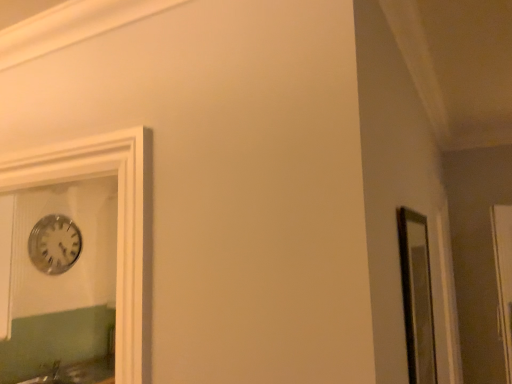
Question: Is transparent glass door at right at the right side of matte glass mirror at right?

Choices:
 (A) no
 (B) yes

Answer: (B)

Question: Is transparent glass door at right surrounding matte glass mirror at right?

Choices:
 (A) yes
 (B) no

Answer: (B)

Question: From a real-world perspective, is transparent glass door at right physically above matte glass mirror at right?

Choices:
 (A) no
 (B) yes

Answer: (A)

Question: Is transparent glass door at right facing towards matte glass mirror at right?

Choices:
 (A) yes
 (B) no

Answer: (B)

Question: Can you confirm if transparent glass door at right is positioned to the left of matte glass mirror at right?

Choices:
 (A) yes
 (B) no

Answer: (B)

Question: From a real-world perspective, is transparent glass door at right physically below matte glass mirror at right?

Choices:
 (A) no
 (B) yes

Answer: (B)

Question: Are transparent glass door at right and silver metallic clock at upper left making contact?

Choices:
 (A) yes
 (B) no

Answer: (B)

Question: Considering the relative sizes of transparent glass door at right and silver metallic clock at upper left in the image provided, is transparent glass door at right thinner than silver metallic clock at upper left?

Choices:
 (A) no
 (B) yes

Answer: (A)

Question: Is transparent glass door at right surrounding silver metallic clock at upper left?

Choices:
 (A) yes
 (B) no

Answer: (B)

Question: Can you confirm if transparent glass door at right is smaller than silver metallic clock at upper left?

Choices:
 (A) yes
 (B) no

Answer: (B)

Question: Considering the relative sizes of transparent glass door at right and silver metallic clock at upper left in the image provided, is transparent glass door at right shorter than silver metallic clock at upper left?

Choices:
 (A) no
 (B) yes

Answer: (A)

Question: Can we say transparent glass door at right lies outside silver metallic clock at upper left?

Choices:
 (A) yes
 (B) no

Answer: (A)

Question: Does matte glass mirror at right lie behind transparent glass door at right?

Choices:
 (A) yes
 (B) no

Answer: (B)